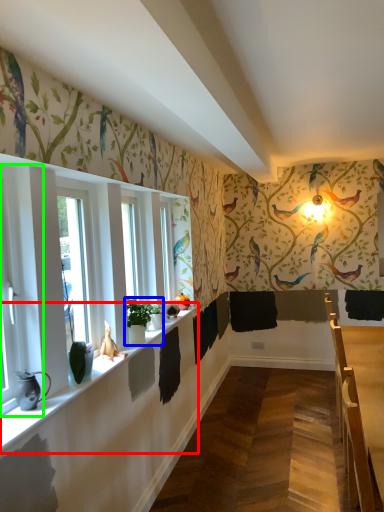
Question: Considering the real-world distances, which object is closest to window sill (highlighted by a red box)? houseplant (highlighted by a blue box) or window (highlighted by a green box).

Choices:
 (A) houseplant
 (B) window

Answer: (A)